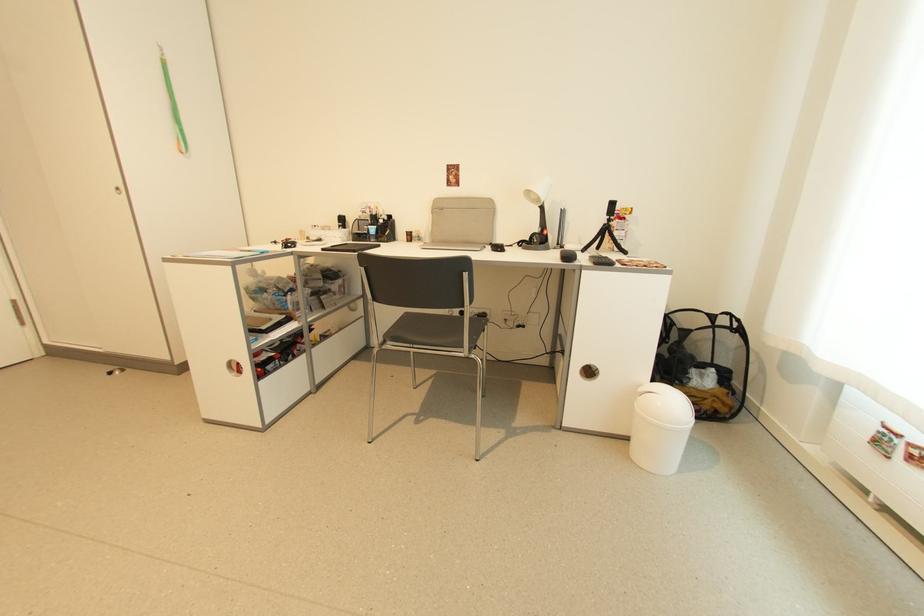
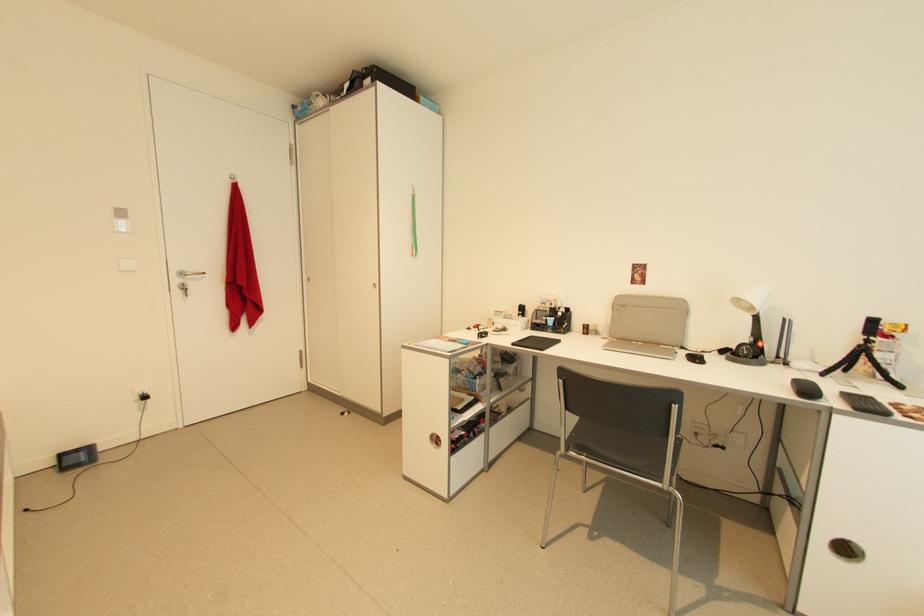
Question: The first image is from the beginning of the video and the second image is from the end. How did the camera likely rotate when shooting the video?

Choices:
 (A) Left
 (B) Right
 (C) Up
 (D) Down

Answer: (A)